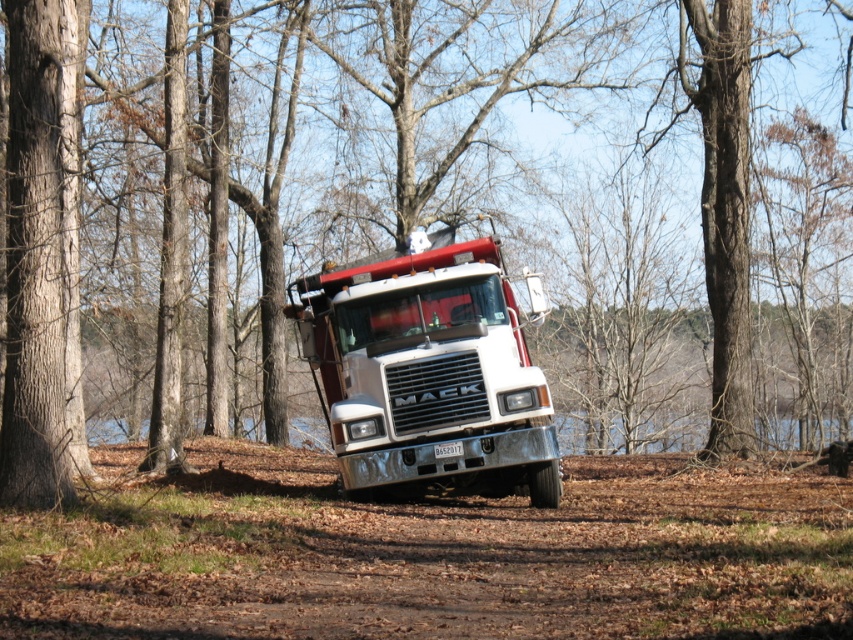
Which is more to the right, brown dirt track at center or white metallic truck at center?

Positioned to the right is white metallic truck at center.

Image resolution: width=853 pixels, height=640 pixels. Identify the location of brown dirt track at center. (436, 556).

At what (x,y) coordinates should I click in order to perform the action: click on brown dirt track at center. Please return your answer as a coordinate pair (x, y). Image resolution: width=853 pixels, height=640 pixels. Looking at the image, I should click on (436, 556).